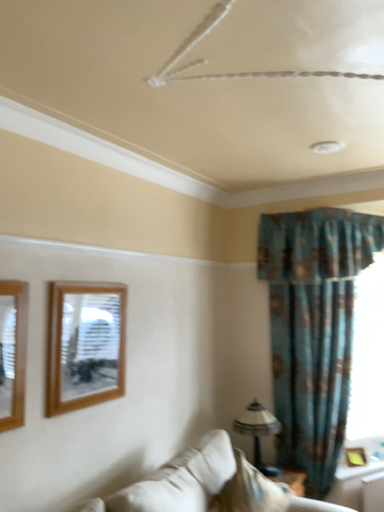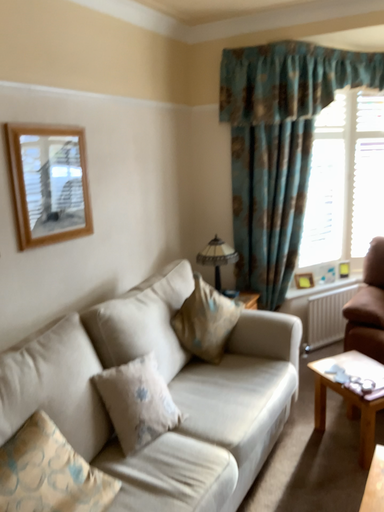
Question: How did the camera likely rotate when shooting the video?

Choices:
 (A) rotated downward
 (B) rotated upward

Answer: (A)